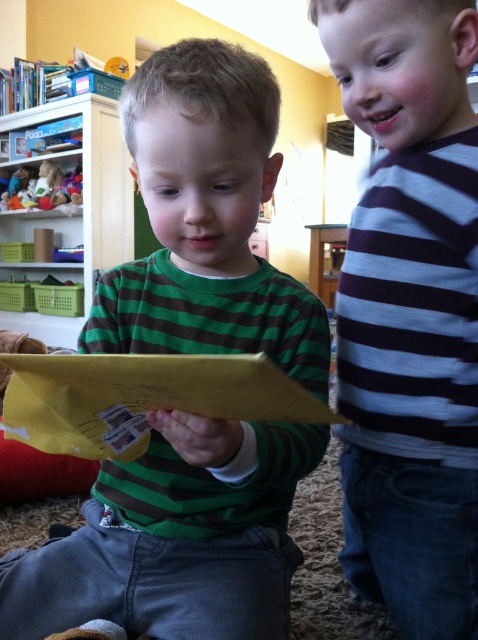
Question: Which point is farther to the camera?

Choices:
 (A) (0, 220)
 (B) (61, 177)

Answer: (A)

Question: From the image, what is the correct spatial relationship of wooden bookshelf at upper left in relation to soft plush bear at upper left?

Choices:
 (A) below
 (B) above

Answer: (A)

Question: Is green striped shirt at center further to camera compared to soft plush bear at upper left?

Choices:
 (A) yes
 (B) no

Answer: (B)

Question: Which point appears farthest from the camera in this image?

Choices:
 (A) (119, 134)
 (B) (202, 561)
 (C) (11, 182)

Answer: (C)

Question: Is green striped shirt at center below striped cotton shirt at right?

Choices:
 (A) no
 (B) yes

Answer: (A)

Question: Which point is closer to the camera?

Choices:
 (A) (371, 312)
 (B) (109, 186)
 (C) (230, 340)

Answer: (C)